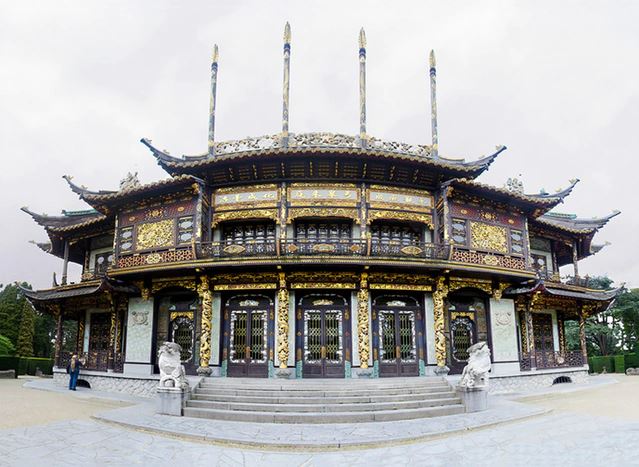
You are a GUI agent. You are given a task and a screenshot of the screen. Output one action in this format:
    pyautogui.click(x=<x>, y=<y>)
    Task: Click on the door
    
    Given the screenshot: What is the action you would take?
    pos(98,346), pos(256,338), pos(321,341), pos(394,333), pos(542,334)